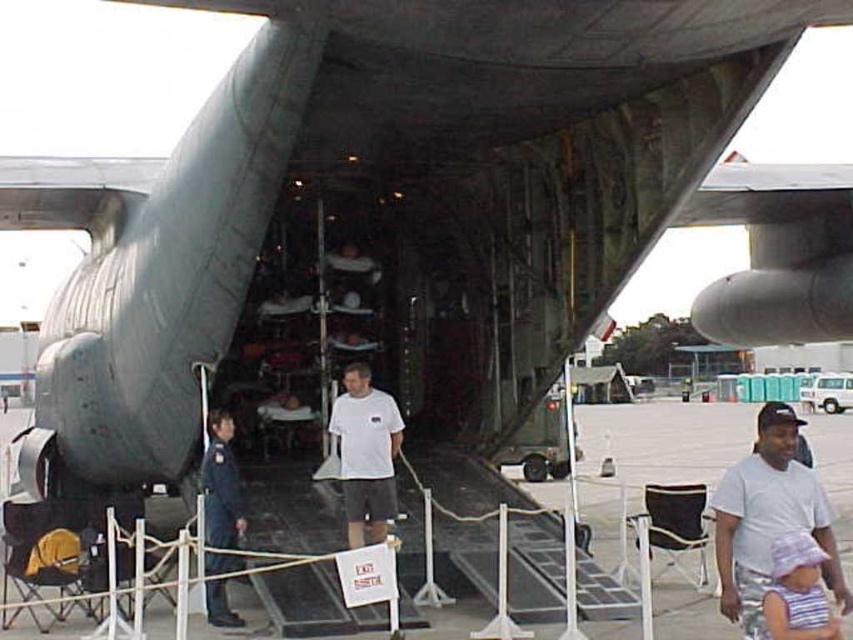
Question: Is gray concrete tarmac at lower center wider than striped fabric hat at lower right?

Choices:
 (A) no
 (B) yes

Answer: (B)

Question: Estimate the real-world distances between objects in this image. Which object is farther from the striped fabric hat at lower right?

Choices:
 (A) white cotton shirt at center
 (B) blue uniform at center
 (C) white matte t-shirt at center
 (D) gray concrete tarmac at lower center

Answer: (B)

Question: Which point is closer to the camera?

Choices:
 (A) white cotton shirt at center
 (B) gray concrete tarmac at lower center

Answer: (A)

Question: Estimate the real-world distances between objects in this image. Which object is closer to the blue uniform at center?

Choices:
 (A) gray concrete tarmac at lower center
 (B) white matte t-shirt at center
 (C) white cotton shirt at center
 (D) striped fabric hat at lower right

Answer: (B)

Question: Does white cotton shirt at center come behind blue uniform at center?

Choices:
 (A) yes
 (B) no

Answer: (B)

Question: Is white cotton shirt at center above striped fabric hat at lower right?

Choices:
 (A) no
 (B) yes

Answer: (B)